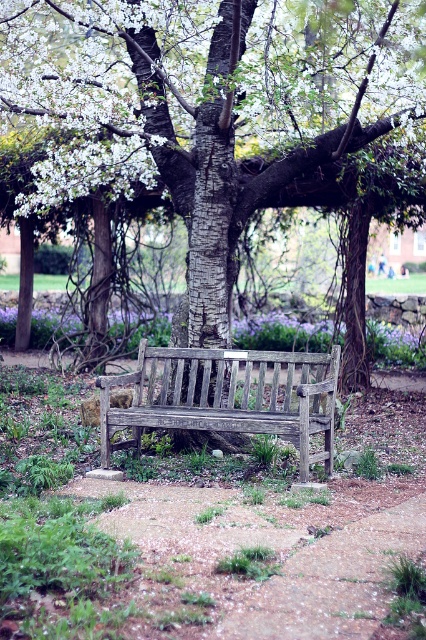
Can you confirm if white blossoms at center is positioned to the left of purple matte flower at center?

Yes, white blossoms at center is to the left of purple matte flower at center.

Is white blossoms at center positioned before purple matte flower at center?

Yes.

Who is more forward, (425, 4) or (63, 330)?

Point (425, 4) is in front.

The height and width of the screenshot is (640, 426). Identify the location of white blossoms at center. (219, 84).

Can you confirm if smooth bark tree at center is taller than purple matte flower at center?

Indeed, smooth bark tree at center has a greater height compared to purple matte flower at center.

Locate an element on the screen. The image size is (426, 640). smooth bark tree at center is located at coordinates (230, 112).

Consider the image. Between smooth bark tree at center and weathered wood bench at center, which one appears on the right side from the viewer's perspective?

From the viewer's perspective, smooth bark tree at center appears more on the right side.

Consider the image. Who is lower down, smooth bark tree at center or weathered wood bench at center?

weathered wood bench at center

What do you see at coordinates (230, 112) in the screenshot? I see `smooth bark tree at center` at bounding box center [230, 112].

Locate an element on the screen. The height and width of the screenshot is (640, 426). smooth bark tree at center is located at coordinates (230, 112).